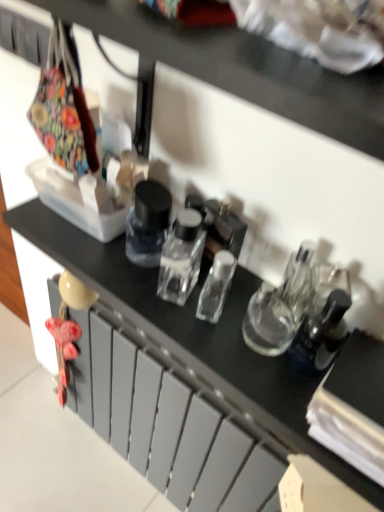
Measure the distance between point (269,446) and camera.

Point (269,446) is 30.43 inches from camera.

This screenshot has height=512, width=384. Identify the location of matte gray drawer at center. (169, 422).

This screenshot has width=384, height=512. What do you see at coordinates (169, 422) in the screenshot? I see `matte gray drawer at center` at bounding box center [169, 422].

Measure the distance between point (249,303) and camera.

They are 23.39 inches apart.

This screenshot has height=512, width=384. Describe the element at coordinates (268, 322) in the screenshot. I see `transparent glass bottle at center` at that location.

Where is `transparent glass bottle at center`? transparent glass bottle at center is located at coordinates (268, 322).

You are a GUI agent. You are given a task and a screenshot of the screen. Output one action in this format:
    pyautogui.click(x=<x>, y=<y>)
    Task: Click on the matte gray drawer at center
    Image resolution: width=384 pixels, height=512 pixels.
    Given the screenshot: What is the action you would take?
    [x=169, y=422]

Is matte gray drawer at center to the left of transparent glass bottle at center from the viewer's perspective?

Yes.

Is matte gray drawer at center further to the viewer compared to transparent glass bottle at center?

Yes.

Which is closer to the camera, (92, 383) or (280, 349)?

The point (280, 349) is closer.

From the image's perspective, is matte gray drawer at center located beneath transparent glass bottle at center?

Yes, from the image's perspective, matte gray drawer at center is below transparent glass bottle at center.

From a real-world perspective, is matte gray drawer at center over transparent glass bottle at center?

No.

Is matte gray drawer at center wider or thinner than transparent glass bottle at center?

matte gray drawer at center is wider than transparent glass bottle at center.

Consider the image. Which of these two, matte gray drawer at center or transparent glass bottle at center, stands shorter?

transparent glass bottle at center.

Who is smaller, matte gray drawer at center or transparent glass bottle at center?

transparent glass bottle at center is smaller.

Is matte gray drawer at center located outside transparent glass bottle at center?

Indeed, matte gray drawer at center is completely outside transparent glass bottle at center.

Are matte gray drawer at center and transparent glass bottle at center beside each other?

No, matte gray drawer at center is not touching transparent glass bottle at center.

Is matte gray drawer at center facing away from transparent glass bottle at center?

matte gray drawer at center does not have its back to transparent glass bottle at center.

Can you tell me how much matte gray drawer at center and transparent glass bottle at center differ in facing direction?

The angular difference between matte gray drawer at center and transparent glass bottle at center is 0.571 degrees.

This screenshot has width=384, height=512. In the image, there is a transparent glass bottle at center. Find the location of `drawer below it (from a real-world perspective)`. drawer below it (from a real-world perspective) is located at coordinates (169, 422).

Considering the positions of objects transparent glass bottle at center and matte gray drawer at center in the image provided, who is more to the right, transparent glass bottle at center or matte gray drawer at center?

From the viewer's perspective, transparent glass bottle at center appears more on the right side.

Considering their positions, is transparent glass bottle at center located in front of or behind matte gray drawer at center?

In the image, transparent glass bottle at center appears in front of matte gray drawer at center.

Does point (266, 325) appear closer or farther from the camera than point (107, 380)?

Point (266, 325) is positioned closer to the camera compared to point (107, 380).

From the image's perspective, which is above, transparent glass bottle at center or matte gray drawer at center?

transparent glass bottle at center appears higher in the image.

From a real-world perspective, is transparent glass bottle at center above or below matte gray drawer at center?

transparent glass bottle at center is situated higher than matte gray drawer at center in the real world.

Looking at this image, between transparent glass bottle at center and matte gray drawer at center, which one has smaller width?

Thinner between the two is transparent glass bottle at center.

Considering the sizes of transparent glass bottle at center and matte gray drawer at center in the image, is transparent glass bottle at center taller or shorter than matte gray drawer at center?

transparent glass bottle at center is shorter than matte gray drawer at center.

Who is bigger, transparent glass bottle at center or matte gray drawer at center?

Bigger between the two is matte gray drawer at center.

Is transparent glass bottle at center not within matte gray drawer at center?

That's correct, transparent glass bottle at center is outside of matte gray drawer at center.

Is transparent glass bottle at center positioned far away from matte gray drawer at center?

No, transparent glass bottle at center is not far away from matte gray drawer at center.

Consider the image. Is transparent glass bottle at center positioned with its back to matte gray drawer at center?

That's not correct — transparent glass bottle at center is not looking away from matte gray drawer at center.

What's the angular difference between transparent glass bottle at center and matte gray drawer at center's facing directions?

0.571 degrees separate the facing orientations of transparent glass bottle at center and matte gray drawer at center.

Find the location of `bottle that is on the right side of matte gray drawer at center`. bottle that is on the right side of matte gray drawer at center is located at coordinates (268, 322).

Image resolution: width=384 pixels, height=512 pixels. What are the coordinates of `drawer beneath the transparent glass bottle at center (from a real-world perspective)` in the screenshot? It's located at (169, 422).

The image size is (384, 512). Find the location of `drawer lying below the transparent glass bottle at center (from the image's perspective)`. drawer lying below the transparent glass bottle at center (from the image's perspective) is located at coordinates (169, 422).